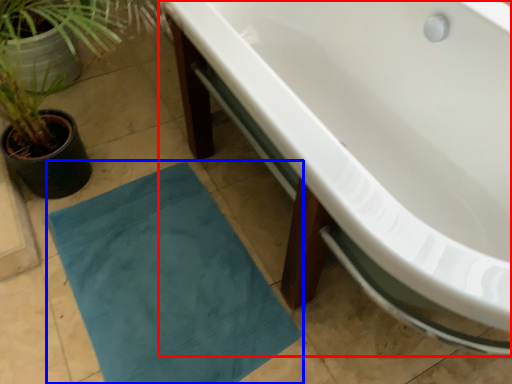
Question: Among these objects, which one is nearest to the camera, bathtub (highlighted by a red box) or bath mat (highlighted by a blue box)?

Choices:
 (A) bathtub
 (B) bath mat

Answer: (A)